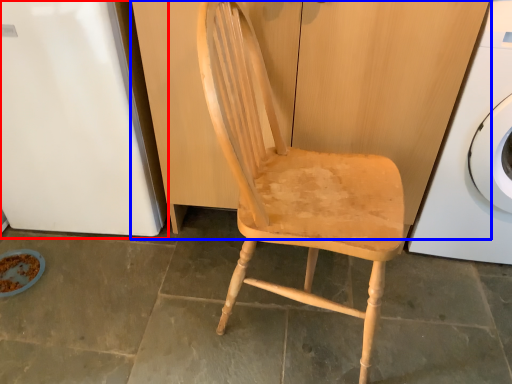
Question: Which object appears farthest to the camera in this image, leftover (highlighted by a red box) or dresser (highlighted by a blue box)?

Choices:
 (A) leftover
 (B) dresser

Answer: (A)